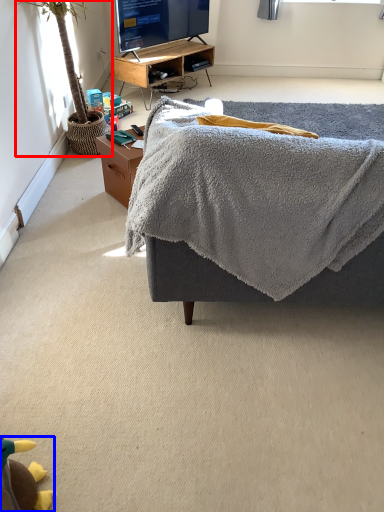
Question: Among these objects, which one is farthest to the camera, houseplant (highlighted by a red box) or toy (highlighted by a blue box)?

Choices:
 (A) houseplant
 (B) toy

Answer: (A)